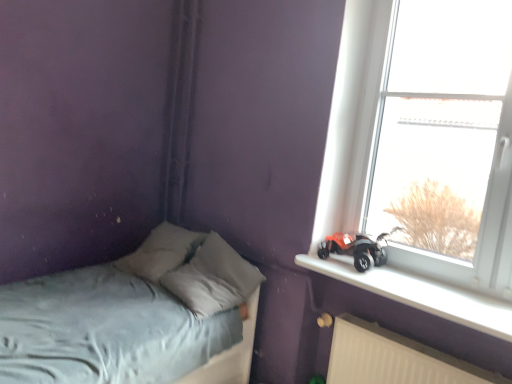
What is the approximate height of transparent glass window at upper right?

transparent glass window at upper right is 1.30 meters in height.

In order to face transparent glass window at upper right, should I rotate leftwards or rightwards?

To face it directly, rotate right by 23.323 degrees.

In the scene shown: What is the approximate height of orange matte toy car at window sill?

It is 8.48 inches.

This screenshot has width=512, height=384. What do you see at coordinates (394, 359) in the screenshot?
I see `white plastic radiator at lower right` at bounding box center [394, 359].

This screenshot has width=512, height=384. In order to click on white plastic window sill at upper right in this screenshot , I will do `click(421, 294)`.

Find the location of a particular element. bed above the white plastic radiator at lower right (from a real-world perspective) is located at coordinates (134, 316).

Considering the relative sizes of light blue fabric bed at lower left and white plastic radiator at lower right in the image provided, is light blue fabric bed at lower left smaller than white plastic radiator at lower right?

Incorrect, light blue fabric bed at lower left is not smaller in size than white plastic radiator at lower right.

Is white plastic window sill at upper right located within light blue fabric bed at lower left?

That's incorrect, white plastic window sill at upper right is not inside light blue fabric bed at lower left.

Considering the relative positions of light blue fabric bed at lower left and white plastic window sill at upper right in the image provided, is light blue fabric bed at lower left behind white plastic window sill at upper right?

No, the depth of light blue fabric bed at lower left is less than that of white plastic window sill at upper right.

Which of these two, light blue fabric bed at lower left or gray fabric pillow at center, is thinner?

gray fabric pillow at center.

Between light blue fabric bed at lower left and gray fabric pillow at center, which one has larger size?

light blue fabric bed at lower left.

Is light blue fabric bed at lower left situated inside gray fabric pillow at center or outside?

light blue fabric bed at lower left is outside gray fabric pillow at center.

Are gray fabric pillow at center and light blue fabric bed at lower left located far from each other?

No, gray fabric pillow at center is not far away from light blue fabric bed at lower left.

Visually, is gray fabric pillow at center positioned to the left or to the right of light blue fabric bed at lower left?

gray fabric pillow at center is positioned on light blue fabric bed at lower left's right side.

From the image's perspective, which one is positioned higher, gray fabric pillow at center or light blue fabric bed at lower left?

gray fabric pillow at center.

Which of these two, gray fabric pillow at center or light blue fabric bed at lower left, is bigger?

With larger size is light blue fabric bed at lower left.

How much distance is there between orange matte toy car at window sill and gray fabric pillow at center?

They are 22.37 inches apart.

Considering the relative sizes of orange matte toy car at window sill and gray fabric pillow at center in the image provided, is orange matte toy car at window sill taller than gray fabric pillow at center?

No, orange matte toy car at window sill is not taller than gray fabric pillow at center.

How different are the orientations of orange matte toy car at window sill and gray fabric pillow at center in degrees?

The facing directions of orange matte toy car at window sill and gray fabric pillow at center are 0.828 degrees apart.

Is orange matte toy car at window sill wider or thinner than gray fabric pillow at center?

Considering their sizes, orange matte toy car at window sill looks slimmer than gray fabric pillow at center.

From a real-world perspective, is white plastic radiator at lower right under gray fabric pillow at center?

Yes, from a real-world perspective, white plastic radiator at lower right is beneath gray fabric pillow at center.

Based on the photo, which is more to the left, white plastic radiator at lower right or gray fabric pillow at center?

gray fabric pillow at center.

Who is bigger, white plastic radiator at lower right or gray fabric pillow at center?

gray fabric pillow at center.

In the scene shown: Considering the sizes of objects white plastic radiator at lower right and gray fabric pillow at center in the image provided, who is shorter, white plastic radiator at lower right or gray fabric pillow at center?

With less height is gray fabric pillow at center.

Is gray fabric pillow at center not within white plastic window sill at upper right?

That's correct, gray fabric pillow at center is outside of white plastic window sill at upper right.

Between gray fabric pillow at center and white plastic window sill at upper right, which one has less height?

white plastic window sill at upper right is shorter.

From a real-world perspective, does gray fabric pillow at center sit lower than white plastic window sill at upper right?

Yes, from a real-world perspective, gray fabric pillow at center is below white plastic window sill at upper right.

Is gray fabric pillow at center closer to camera compared to white plastic window sill at upper right?

No.

Where is `bed on the left of white plastic radiator at lower right`? Image resolution: width=512 pixels, height=384 pixels. bed on the left of white plastic radiator at lower right is located at coordinates (134, 316).

The height and width of the screenshot is (384, 512). In the image, there is a white plastic window sill at upper right. In order to click on bed below it (from a real-world perspective) in this screenshot , I will do `click(134, 316)`.

Considering their positions, is gray fabric pillow at center positioned further to transparent glass window at upper right than light blue fabric bed at lower left?

light blue fabric bed at lower left is further to transparent glass window at upper right.

From the image, which object appears to be nearer to white plastic radiator at lower right, transparent glass window at upper right or gray fabric pillow at center?

transparent glass window at upper right.

In the scene shown: From the image, which object appears to be farther from transparent glass window at upper right, orange matte toy car at window sill or gray fabric pillow at center?

gray fabric pillow at center.

Which object lies further to the anchor point orange matte toy car at window sill, transparent glass window at upper right or light blue fabric bed at lower left?

Among the two, light blue fabric bed at lower left is located further to orange matte toy car at window sill.

Which object lies nearer to the anchor point gray fabric pillow at center, white plastic radiator at lower right or transparent glass window at upper right?

transparent glass window at upper right is positioned closer to the anchor gray fabric pillow at center.

From the image, which object appears to be nearer to transparent glass window at upper right, gray fabric pillow at center or white plastic window sill at upper right?

white plastic window sill at upper right is closer to transparent glass window at upper right.

When comparing their distances from orange matte toy car at window sill, does transparent glass window at upper right or white plastic radiator at lower right seem further?

The object further to orange matte toy car at window sill is white plastic radiator at lower right.

From the image, which object appears to be farther from orange matte toy car at window sill, white plastic window sill at upper right or light blue fabric bed at lower left?

light blue fabric bed at lower left is further to orange matte toy car at window sill.

Find the location of a particular element. This screenshot has width=512, height=384. window sill between gray fabric pillow at center and transparent glass window at upper right from left to right is located at coordinates (421, 294).

You are a GUI agent. You are given a task and a screenshot of the screen. Output one action in this format:
    pyautogui.click(x=<x>, y=<y>)
    Task: Click on the pillow between light blue fabric bed at lower left and transparent glass window at upper right from left to right
    The width and height of the screenshot is (512, 384).
    Given the screenshot: What is the action you would take?
    pyautogui.click(x=213, y=278)

What are the coordinates of `land vehicle between gray fabric pillow at center and white plastic window sill at upper right in the horizontal direction` in the screenshot? It's located at pos(357,248).

This screenshot has height=384, width=512. In order to click on radiator between light blue fabric bed at lower left and white plastic window sill at upper right in this screenshot , I will do `click(394, 359)`.